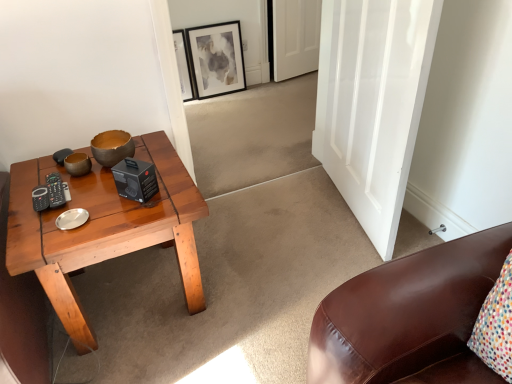
I want to click on free region under wooden coffee table at left (from a real-world perspective), so click(x=134, y=286).